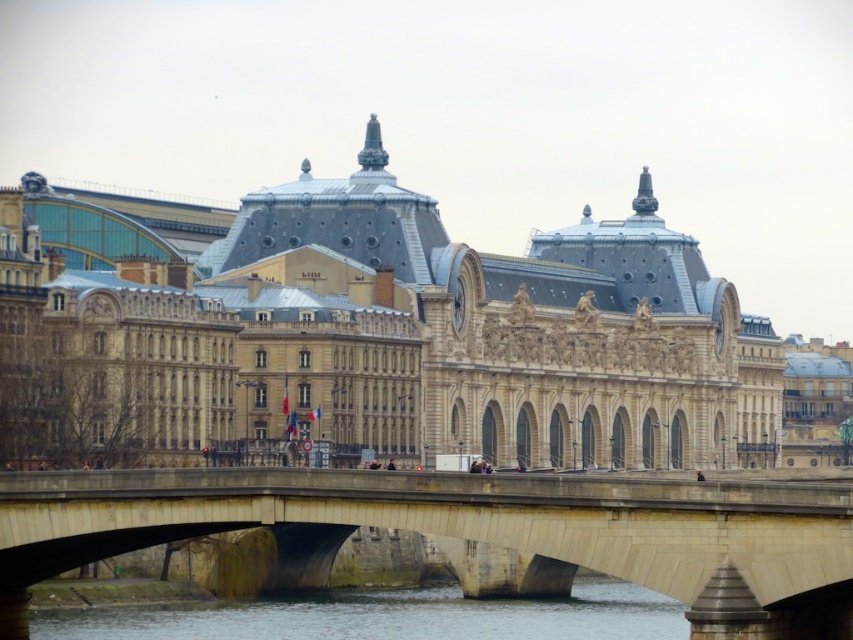
Which is more to the left, beige stone palace at center or clear water at lower center?

Positioned to the left is clear water at lower center.

Locate an element on the screen. beige stone palace at center is located at coordinates (386, 337).

Can you confirm if beige stone palace at center is positioned to the left of beige stone bridge at center?

No, beige stone palace at center is not to the left of beige stone bridge at center.

Can you confirm if beige stone palace at center is positioned to the right of beige stone bridge at center?

Correct, you'll find beige stone palace at center to the right of beige stone bridge at center.

Which is in front, point (199, 227) or point (73, 563)?

Point (73, 563)

Locate an element on the screen. beige stone palace at center is located at coordinates (386, 337).

Can you confirm if beige stone bridge at center is shorter than clear water at lower center?

No, beige stone bridge at center is not shorter than clear water at lower center.

Does point (743, 493) lie in front of point (653, 618)?

Yes, it is in front of point (653, 618).

Locate an element on the screen. The image size is (853, 640). beige stone bridge at center is located at coordinates (469, 532).